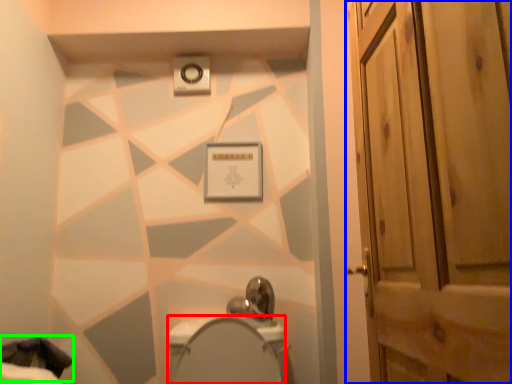
Question: Considering the real-world distances, which object is closest to bidet (highlighted by a red box)? door (highlighted by a blue box) or laundry (highlighted by a green box).

Choices:
 (A) door
 (B) laundry

Answer: (B)